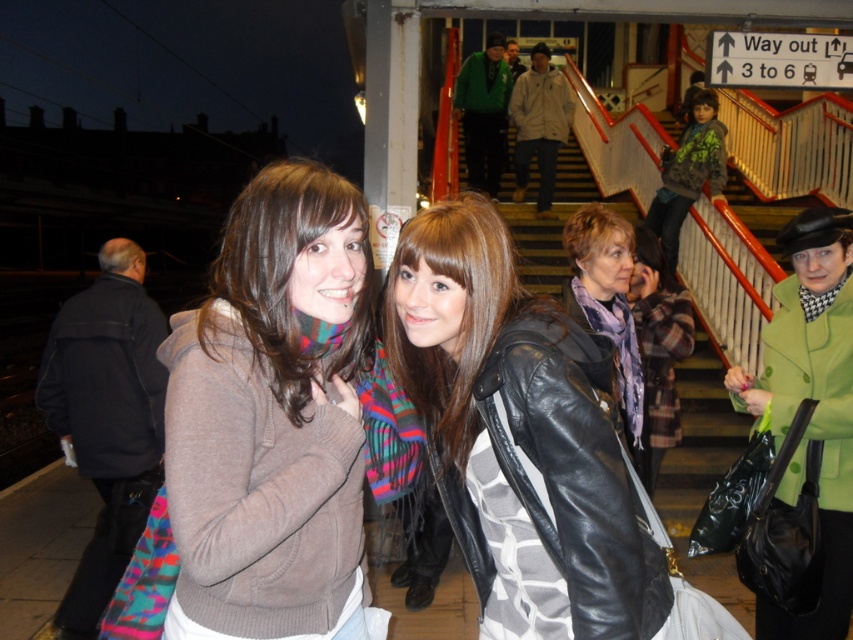
Question: Which of these objects is positioned farthest from the leather jacket at center?

Choices:
 (A) matte brown sweater at center
 (B) green leather coat at upper right
 (C) purple scarf at center
 (D) green textured hoodie at upper right

Answer: (D)

Question: Which point is closer to the camera?

Choices:
 (A) (299, 540)
 (B) (583, 237)
 (C) (685, 168)

Answer: (A)

Question: Can you confirm if matte brown sweater at center is positioned below leather jacket at center?

Choices:
 (A) no
 (B) yes

Answer: (A)

Question: Does matte brown sweater at center have a smaller size compared to purple scarf at center?

Choices:
 (A) no
 (B) yes

Answer: (B)

Question: Based on their relative distances, which object is farther from the green textured hoodie at upper right?

Choices:
 (A) purple scarf at center
 (B) green leather coat at upper right

Answer: (B)

Question: Does purple scarf at center appear over green textured hoodie at upper right?

Choices:
 (A) yes
 (B) no

Answer: (B)